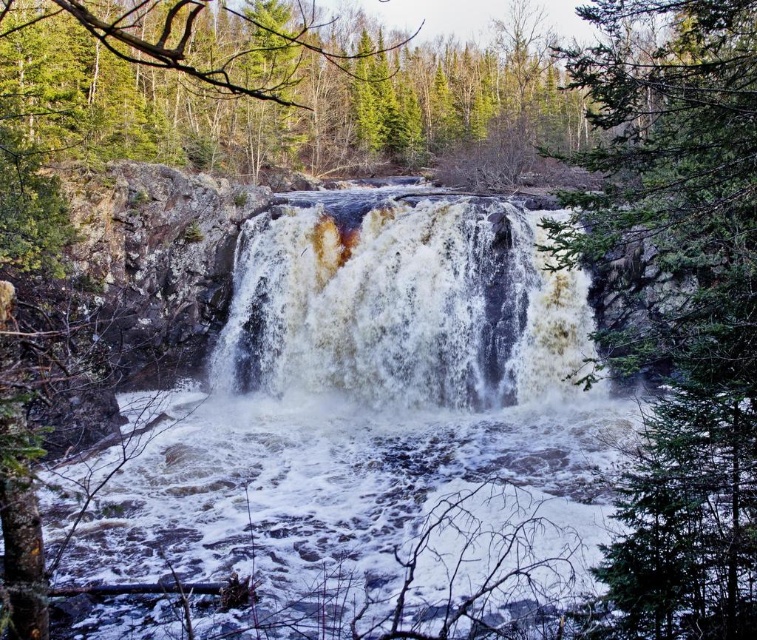
Question: Is green textured pine tree at center to the left of white frothy water at center from the viewer's perspective?

Choices:
 (A) yes
 (B) no

Answer: (B)

Question: Does green textured pine tree at center appear over white frothy water at center?

Choices:
 (A) yes
 (B) no

Answer: (A)

Question: Can you confirm if green textured pine tree at center is positioned below white frothy water at center?

Choices:
 (A) yes
 (B) no

Answer: (B)

Question: Which of the following is the farthest from the observer?

Choices:
 (A) green textured pine tree at center
 (B) white frothy water at center

Answer: (B)

Question: Which point appears closest to the camera in this image?

Choices:
 (A) tap(646, 372)
 (B) tap(466, 256)

Answer: (A)